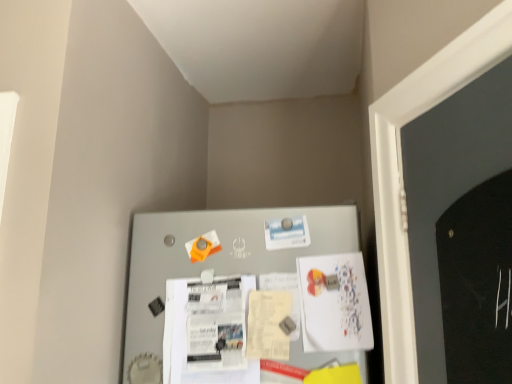
Question: Is the position of white paper poster at center, the 2th poster positioned from the right, less distant than that of metallic gray bulletin board at center?

Choices:
 (A) yes
 (B) no

Answer: (B)

Question: From a real-world perspective, is white paper poster at center, the 2th poster positioned from the right, physically below metallic gray bulletin board at center?

Choices:
 (A) no
 (B) yes

Answer: (B)

Question: Is white paper poster at center, the 2th poster positioned from the right, not inside metallic gray bulletin board at center?

Choices:
 (A) no
 (B) yes

Answer: (A)

Question: Can you confirm if white paper poster at center, positioned as the 1th poster in left-to-right order, is positioned to the right of metallic gray bulletin board at center?

Choices:
 (A) yes
 (B) no

Answer: (B)

Question: From a real-world perspective, is white paper poster at center, the 2th poster positioned from the right, on top of metallic gray bulletin board at center?

Choices:
 (A) yes
 (B) no

Answer: (B)

Question: Do you think white paper poster at center, which appears as the second poster when viewed from the left, is within metallic gray bulletin board at center, or outside of it?

Choices:
 (A) outside
 (B) inside

Answer: (B)

Question: Does point (337, 283) appear closer or farther from the camera than point (269, 256)?

Choices:
 (A) farther
 (B) closer

Answer: (B)

Question: From the image's perspective, is white paper poster at center, which appears as the second poster when viewed from the left, positioned above or below metallic gray bulletin board at center?

Choices:
 (A) above
 (B) below

Answer: (B)

Question: In terms of width, does white paper poster at center, which appears as the second poster when viewed from the left, look wider or thinner when compared to metallic gray bulletin board at center?

Choices:
 (A) wide
 (B) thin

Answer: (B)

Question: Considering the positions of white paper poster at center, positioned as the 1th poster in left-to-right order, and metallic gray bulletin board at center in the image, is white paper poster at center, positioned as the 1th poster in left-to-right order, taller or shorter than metallic gray bulletin board at center?

Choices:
 (A) short
 (B) tall

Answer: (A)

Question: Is white paper poster at center, positioned as the 1th poster in left-to-right order, situated inside metallic gray bulletin board at center or outside?

Choices:
 (A) inside
 (B) outside

Answer: (A)

Question: Is point (203, 345) closer or farther from the camera than point (224, 231)?

Choices:
 (A) closer
 (B) farther

Answer: (A)

Question: From a real-world perspective, is white paper poster at center, positioned as the 1th poster in left-to-right order, above or below metallic gray bulletin board at center?

Choices:
 (A) above
 (B) below

Answer: (B)

Question: Would you say metallic gray bulletin board at center is to the left or to the right of white paper poster at center, the 2th poster positioned from the right, in the picture?

Choices:
 (A) left
 (B) right

Answer: (B)

Question: In terms of height, does metallic gray bulletin board at center look taller or shorter compared to white paper poster at center, the 2th poster positioned from the right?

Choices:
 (A) tall
 (B) short

Answer: (A)